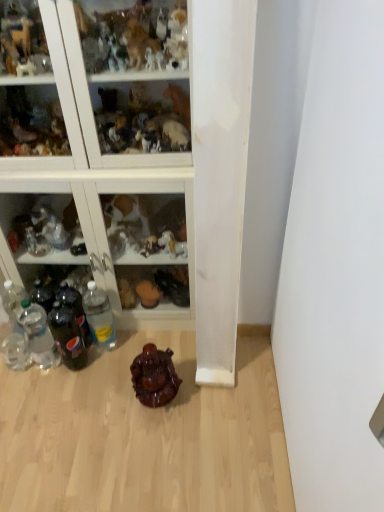
At what (x,y) coordinates should I click in order to perform the action: click on vacant space to the right of clear plastic bottle at lower left, arranged as the first bottle when viewed from the right. Please return your answer as a coordinate pair (x, y). This screenshot has width=384, height=512. Looking at the image, I should click on (158, 341).